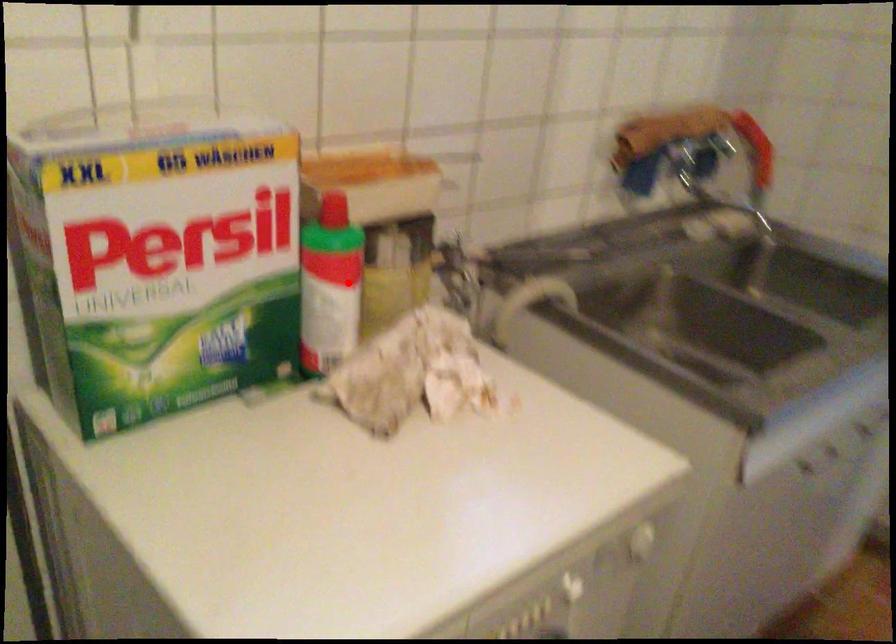
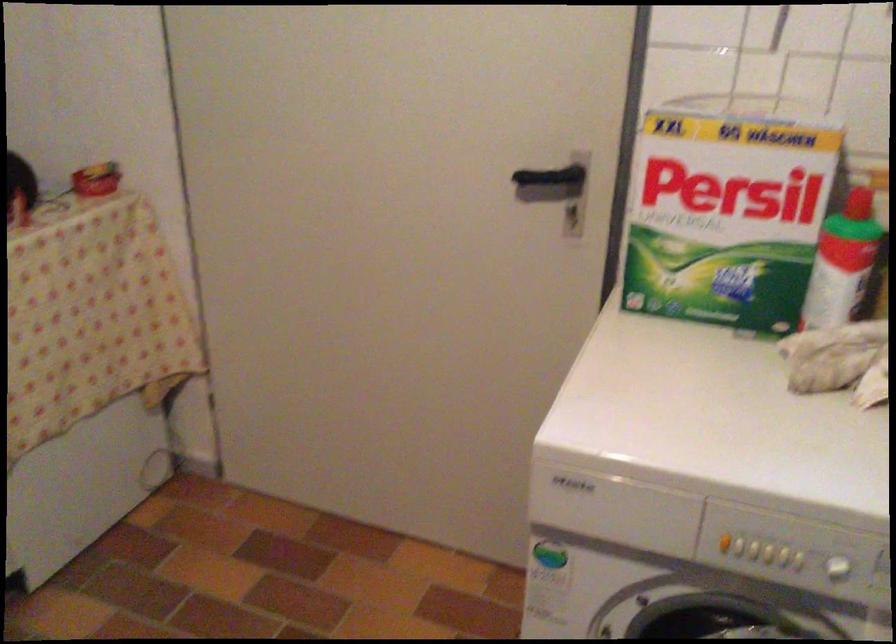
Where in the second image is the point corresponding to the highlighted location from the first image?

(842, 263)